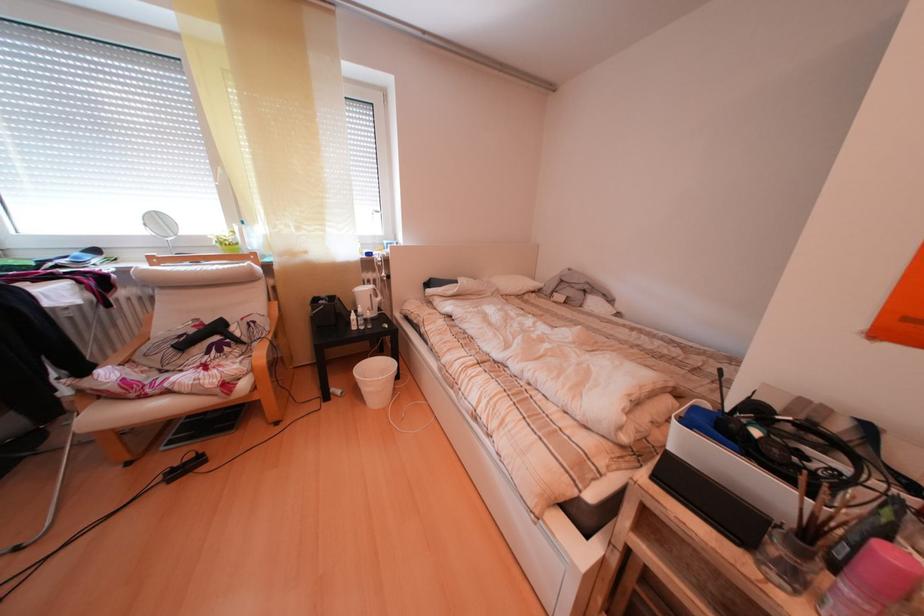
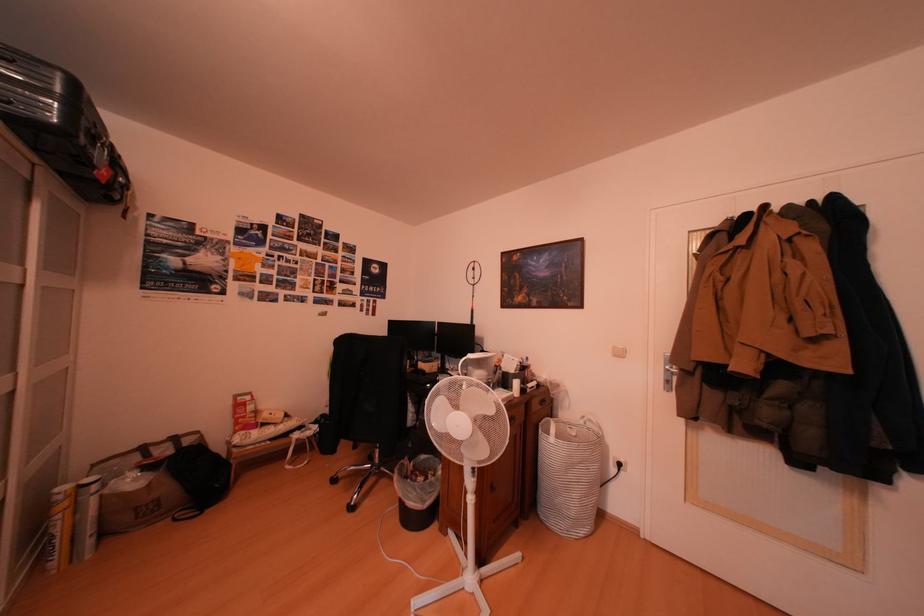
Question: The first image is from the beginning of the video and the second image is from the end. How did the camera likely rotate when shooting the video?

Choices:
 (A) Left
 (B) Right
 (C) Up
 (D) Down

Answer: (B)